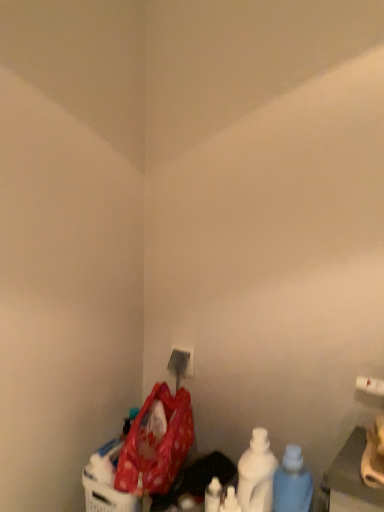
Question: Which direction should I rotate to look at white plastic electric outlet at lower center?

Choices:
 (A) right
 (B) left

Answer: (B)

Question: From a real-world perspective, does white matte bottle at lower right, acting as the second bottle starting from the right, stand above white plastic electric outlet at lower center?

Choices:
 (A) yes
 (B) no

Answer: (B)

Question: Considering the relative positions of white matte bottle at lower right, which ranks as the second bottle in left-to-right order, and white plastic electric outlet at lower center in the image provided, is white matte bottle at lower right, which ranks as the second bottle in left-to-right order, to the right of white plastic electric outlet at lower center from the viewer's perspective?

Choices:
 (A) no
 (B) yes

Answer: (B)

Question: Is white plastic electric outlet at lower center located within white matte bottle at lower right, acting as the second bottle starting from the right?

Choices:
 (A) no
 (B) yes

Answer: (A)

Question: Does white matte bottle at lower right, acting as the second bottle starting from the right, come behind white plastic electric outlet at lower center?

Choices:
 (A) no
 (B) yes

Answer: (A)

Question: From the image's perspective, does white matte bottle at lower right, which ranks as the second bottle in left-to-right order, appear lower than white plastic electric outlet at lower center?

Choices:
 (A) no
 (B) yes

Answer: (B)

Question: Considering the relative sizes of white matte bottle at lower right, which ranks as the second bottle in left-to-right order, and white plastic electric outlet at lower center in the image provided, is white matte bottle at lower right, which ranks as the second bottle in left-to-right order, bigger than white plastic electric outlet at lower center?

Choices:
 (A) yes
 (B) no

Answer: (A)

Question: Is blue translucent bottle at lower right, which appears as the 1th bottle when viewed from the right, completely or partially outside of white matte bottle at lower center, arranged as the first bottle when viewed from the left?

Choices:
 (A) yes
 (B) no

Answer: (A)

Question: Does blue translucent bottle at lower right, which appears as the 1th bottle when viewed from the right, have a greater height compared to white matte bottle at lower center, arranged as the first bottle when viewed from the left?

Choices:
 (A) no
 (B) yes

Answer: (B)

Question: Is blue translucent bottle at lower right, which appears as the 1th bottle when viewed from the right, at the left side of white matte bottle at lower center, positioned as the 3th bottle in right-to-left order?

Choices:
 (A) yes
 (B) no

Answer: (B)

Question: Does blue translucent bottle at lower right, which appears as the 1th bottle when viewed from the right, have a greater width compared to white matte bottle at lower center, positioned as the 3th bottle in right-to-left order?

Choices:
 (A) yes
 (B) no

Answer: (A)

Question: From a real-world perspective, is blue translucent bottle at lower right, which appears as the 1th bottle when viewed from the right, on white matte bottle at lower center, arranged as the first bottle when viewed from the left?

Choices:
 (A) no
 (B) yes

Answer: (B)

Question: Are blue translucent bottle at lower right, the third bottle viewed from the left, and white matte bottle at lower center, positioned as the 3th bottle in right-to-left order, beside each other?

Choices:
 (A) yes
 (B) no

Answer: (B)

Question: Is polka dot fabric bag at lower left looking in the opposite direction of white matte bottle at lower right, which ranks as the second bottle in left-to-right order?

Choices:
 (A) yes
 (B) no

Answer: (A)